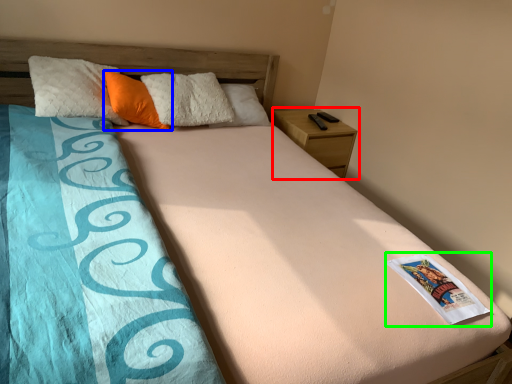
Question: Which object is the farthest from nightstand (highlighted by a red box)? Choose among these: pillow (highlighted by a blue box) or paperback book (highlighted by a green box).

Choices:
 (A) pillow
 (B) paperback book

Answer: (B)